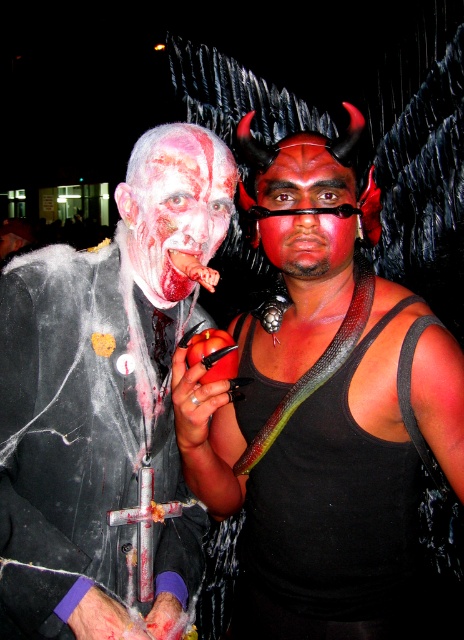
Question: Estimate the real-world distances between objects in this image. Which object is farther from the matte black cross at center?

Choices:
 (A) green snake at center
 (B) green glossy snake at center
 (C) matte red face paint at center

Answer: (C)

Question: Which is farther from the matte black cross at center?

Choices:
 (A) green snake at center
 (B) green glossy snake at center

Answer: (B)

Question: Is matte red face paint at center in front of green glossy snake at center?

Choices:
 (A) yes
 (B) no

Answer: (A)

Question: Does matte black cross at center have a smaller size compared to green snake at center?

Choices:
 (A) yes
 (B) no

Answer: (B)

Question: Which object appears closest to the camera in this image?

Choices:
 (A) matte black cross at center
 (B) bloody flesh at center

Answer: (A)

Question: Does matte black cross at center have a greater width compared to green snake at center?

Choices:
 (A) yes
 (B) no

Answer: (A)